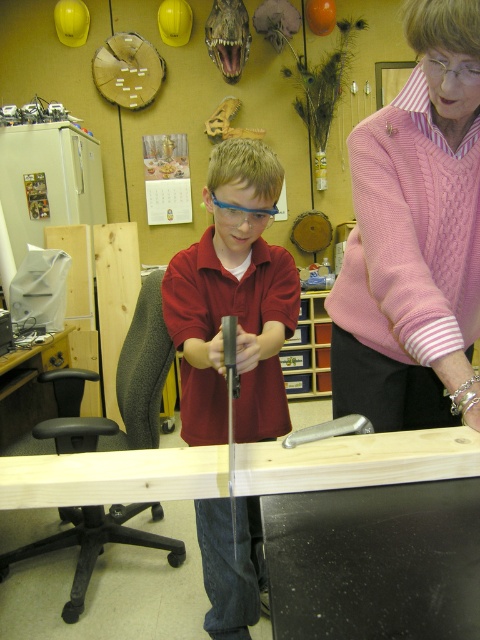
You are standing in the workshop and want to reach the point marked at coordinates (223,529). If you take a step forward of 1 meter, will you be closer to that point?

The distance between you and the point marked at coordinates (223,529) is 1.58 meters. Taking a step forward of 1 meter will reduce the distance to 0.58 meters, so yes, you will be closer to that point.